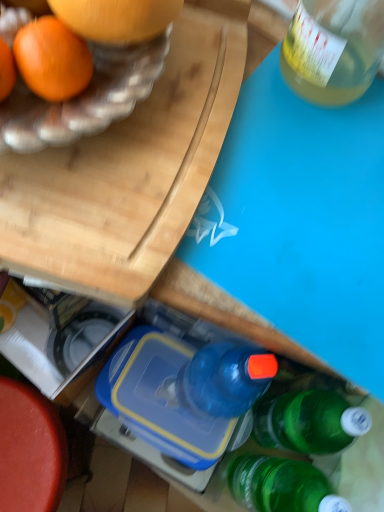
Question: Does blue plastic lunch box at center appear on the right side of wooden cutting board at upper left?

Choices:
 (A) no
 (B) yes

Answer: (B)

Question: Considering the relative sizes of blue plastic lunch box at center and wooden cutting board at upper left in the image provided, is blue plastic lunch box at center wider than wooden cutting board at upper left?

Choices:
 (A) yes
 (B) no

Answer: (B)

Question: Is wooden cutting board at upper left located within blue plastic lunch box at center?

Choices:
 (A) yes
 (B) no

Answer: (B)

Question: Is blue plastic lunch box at center not close to wooden cutting board at upper left?

Choices:
 (A) yes
 (B) no

Answer: (B)

Question: Is blue plastic lunch box at center to the left of wooden cutting board at upper left from the viewer's perspective?

Choices:
 (A) yes
 (B) no

Answer: (B)

Question: Is point pyautogui.click(x=190, y=347) positioned closer to the camera than point pyautogui.click(x=54, y=441)?

Choices:
 (A) closer
 (B) farther

Answer: (A)

Question: Is blue plastic lunch box at center wider or thinner than smooth red table at lower left?

Choices:
 (A) thin
 (B) wide

Answer: (A)

Question: Is blue plastic lunch box at center to the left or to the right of smooth red table at lower left in the image?

Choices:
 (A) left
 (B) right

Answer: (B)

Question: From a real-world perspective, is blue plastic lunch box at center positioned above or below smooth red table at lower left?

Choices:
 (A) above
 (B) below

Answer: (A)

Question: From a real-world perspective, is blue plastic lunch box at center physically located above or below wooden cutting board at upper left?

Choices:
 (A) above
 (B) below

Answer: (B)

Question: Is point (188, 458) closer or farther from the camera than point (34, 236)?

Choices:
 (A) farther
 (B) closer

Answer: (A)

Question: In terms of size, does blue plastic lunch box at center appear bigger or smaller than wooden cutting board at upper left?

Choices:
 (A) big
 (B) small

Answer: (B)

Question: Is blue plastic lunch box at center inside or outside of wooden cutting board at upper left?

Choices:
 (A) inside
 (B) outside

Answer: (B)

Question: Is point (26, 460) closer or farther from the camera than point (147, 343)?

Choices:
 (A) closer
 (B) farther

Answer: (B)

Question: From a real-world perspective, is smooth red table at lower left physically located above or below blue plastic lunch box at center?

Choices:
 (A) above
 (B) below

Answer: (B)